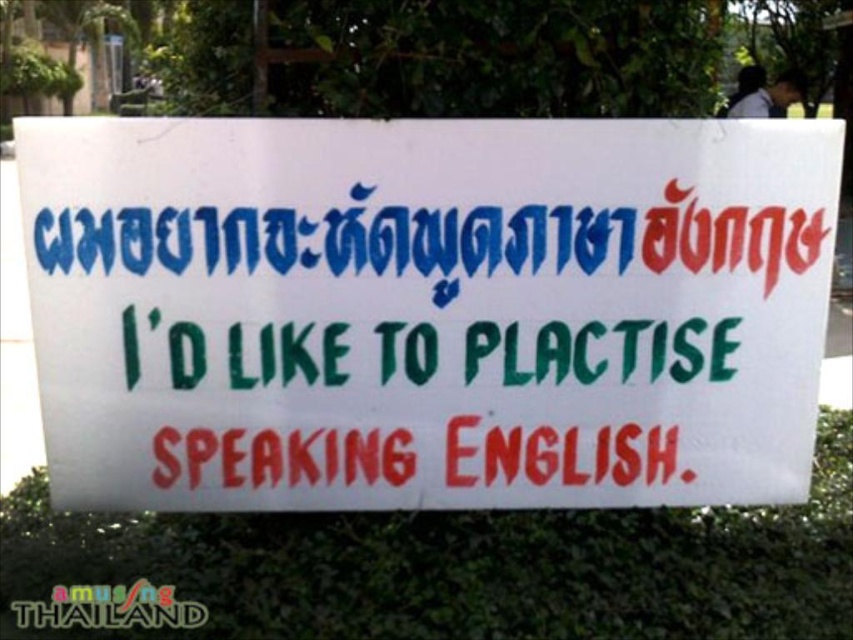
What is the main message displayed on the white paper sign at center?

The main message displayed on the white paper sign at center is the English phrase I would like to practise speaking English, though there is a misspelling in the word PRACTISE, which is written as PLACTISE.